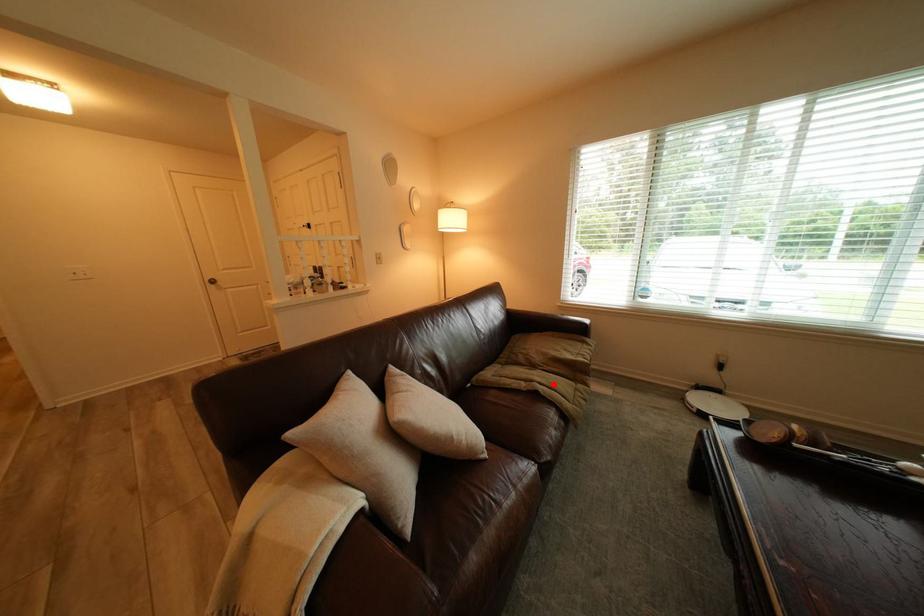
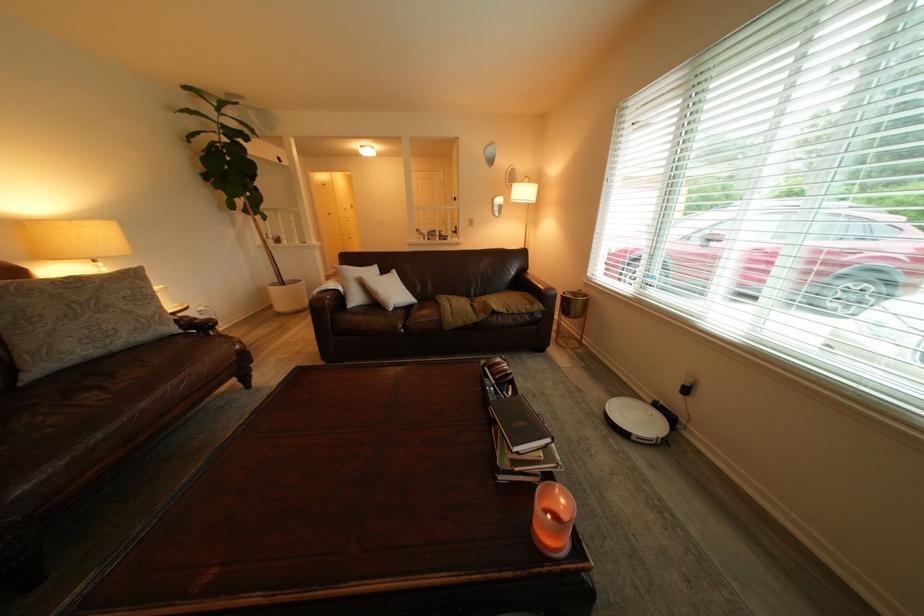
The point at the highlighted location is marked in the first image. Where is the corresponding point in the second image?

(465, 305)